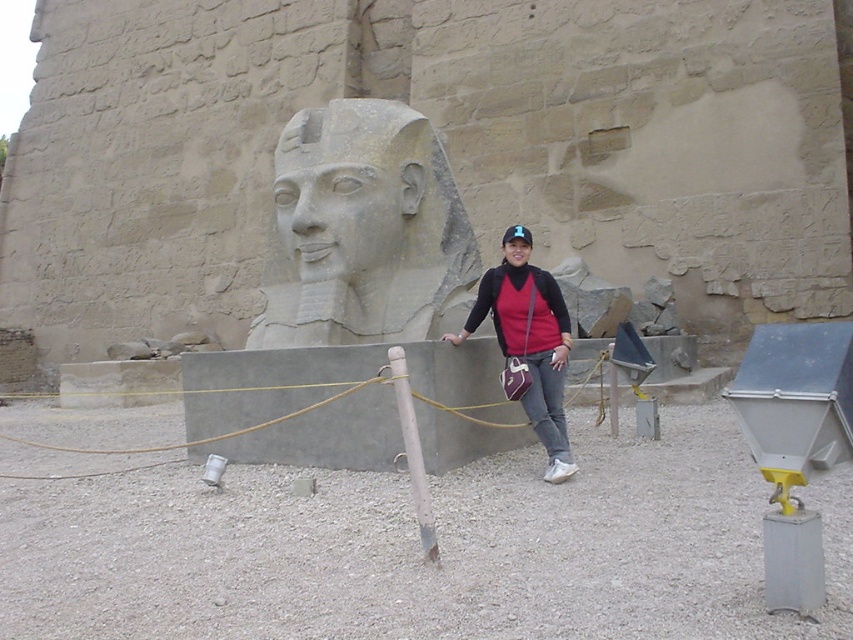
Is point (547, 312) positioned after point (392, 385)?

Yes, point (547, 312) is behind point (392, 385).

Is matte black sweatshirt at center shorter than white wood pole at center?

Yes, matte black sweatshirt at center is shorter than white wood pole at center.

Measure the distance between matte black sweatshirt at center and camera.

They are 6.91 meters apart.

You are a GUI agent. You are given a task and a screenshot of the screen. Output one action in this format:
    pyautogui.click(x=<x>, y=<y>)
    Task: Click on the matte black sweatshirt at center
    Image resolution: width=853 pixels, height=640 pixels.
    Given the screenshot: What is the action you would take?
    pyautogui.click(x=520, y=308)

Is gray stone head at center to the left of matte black sweatshirt at center from the viewer's perspective?

Indeed, gray stone head at center is positioned on the left side of matte black sweatshirt at center.

Measure the distance between gray stone head at center and matte black sweatshirt at center.

gray stone head at center and matte black sweatshirt at center are 4.07 feet apart.

Describe the element at coordinates (361, 209) in the screenshot. I see `gray stone head at center` at that location.

You are a GUI agent. You are given a task and a screenshot of the screen. Output one action in this format:
    pyautogui.click(x=<x>, y=<y>)
    Task: Click on the gray stone head at center
    This screenshot has height=640, width=853.
    Given the screenshot: What is the action you would take?
    pyautogui.click(x=361, y=209)

In the scene shown: Is gray stone head at center thinner than white wood pole at center?

No.

Can you confirm if gray stone head at center is smaller than white wood pole at center?

Actually, gray stone head at center might be larger than white wood pole at center.

What are the coordinates of `gray stone head at center` in the screenshot? It's located at (361, 209).

The height and width of the screenshot is (640, 853). I want to click on gray stone head at center, so click(x=361, y=209).